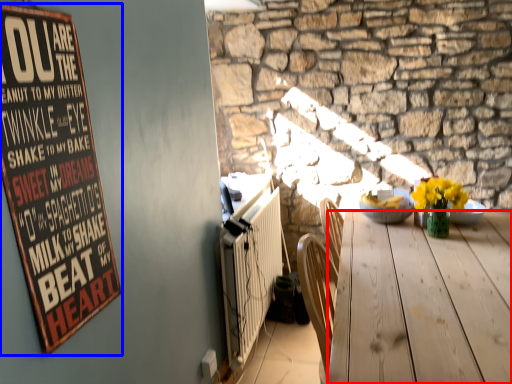
Question: Which of the following is the closest to the observer, desk (highlighted by a red box) or bulletin board (highlighted by a blue box)?

Choices:
 (A) desk
 (B) bulletin board

Answer: (B)